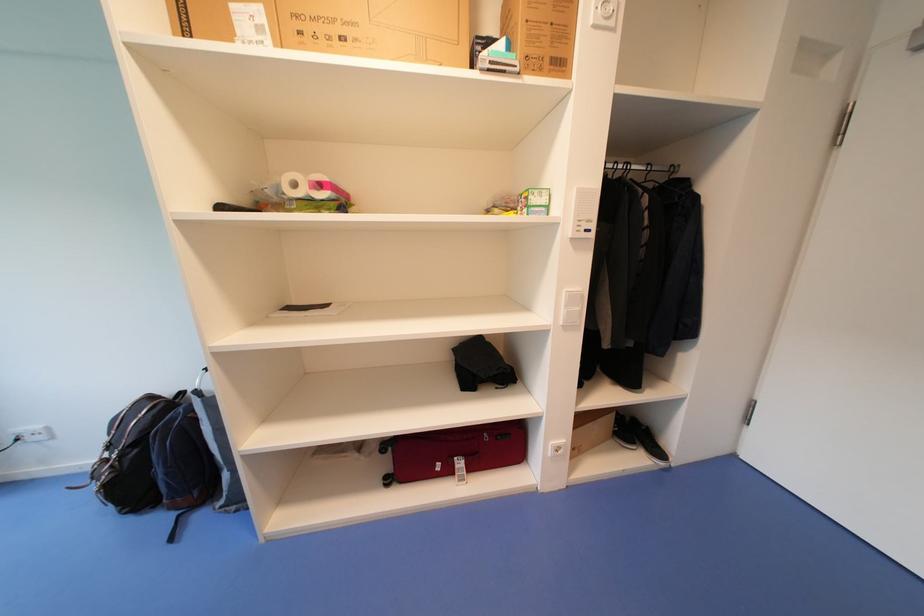
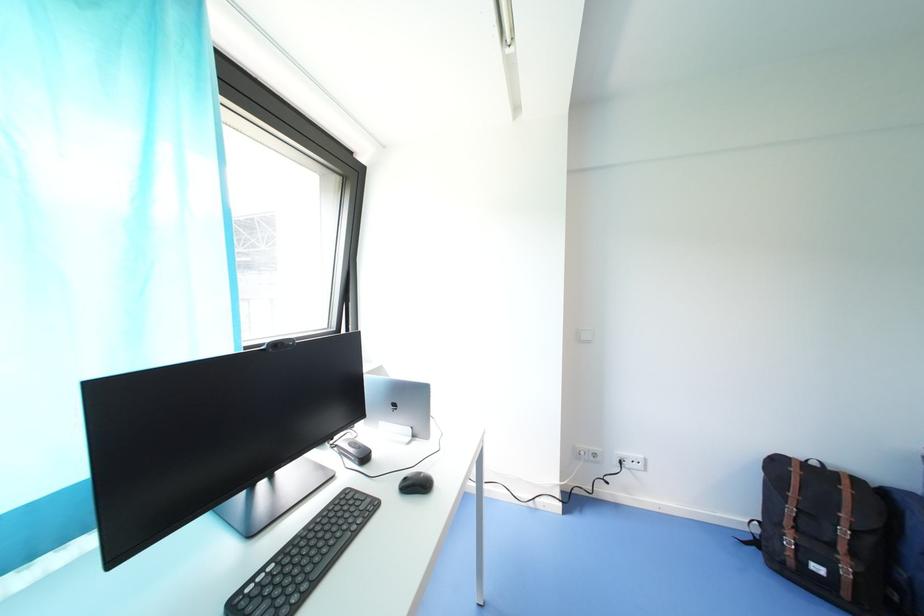
Question: In a continuous first-person perspective shot, in which direction is the camera moving?

Choices:
 (A) Left
 (B) Right
 (C) Forward
 (D) Backward

Answer: (A)